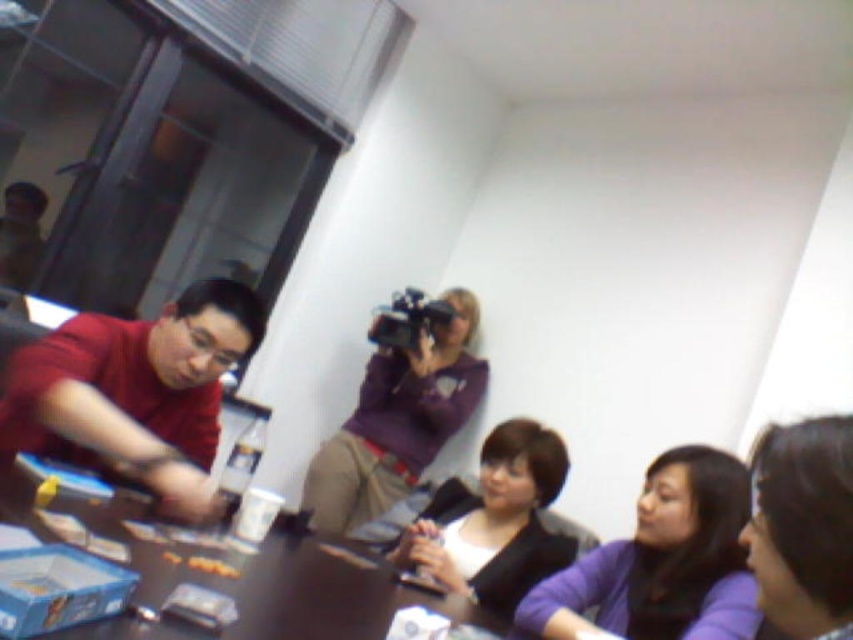
Question: Which of the following is the closest to the observer?

Choices:
 (A) smooth purple shirt at lower right
 (B) matte black jacket at center
 (C) purple matte shirt at lower right
 (D) purple matte camera at upper center

Answer: (A)

Question: Which point is closer to the camera?

Choices:
 (A) (53, 340)
 (B) (844, 429)
 (C) (453, 342)

Answer: (B)

Question: Is dark brown wooden table at center below matte black jacket at center?

Choices:
 (A) yes
 (B) no

Answer: (B)

Question: Which point is closer to the camera?

Choices:
 (A) (459, 579)
 (B) (804, 524)
 (C) (430, 362)

Answer: (B)

Question: Does purple matte camera at upper center appear on the left side of smooth purple shirt at lower right?

Choices:
 (A) no
 (B) yes

Answer: (B)

Question: Is dark brown wooden table at center smaller than purple matte camera at upper center?

Choices:
 (A) no
 (B) yes

Answer: (B)